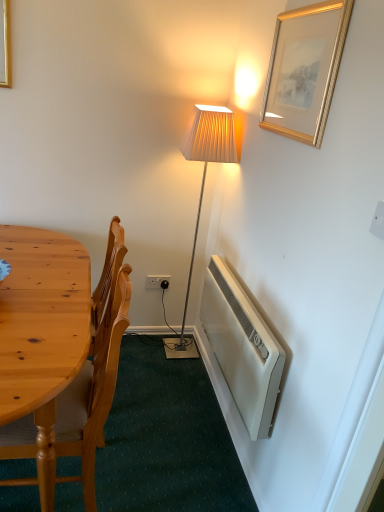
This screenshot has height=512, width=384. I want to click on vacant region to the right of wooden chair at left, so click(x=176, y=467).